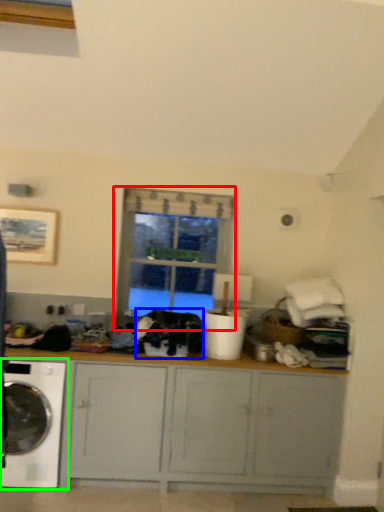
Question: Which object is the farthest from window (highlighted by a red box)? Choose among these: clothing (highlighted by a blue box) or washing machine (highlighted by a green box).

Choices:
 (A) clothing
 (B) washing machine

Answer: (B)